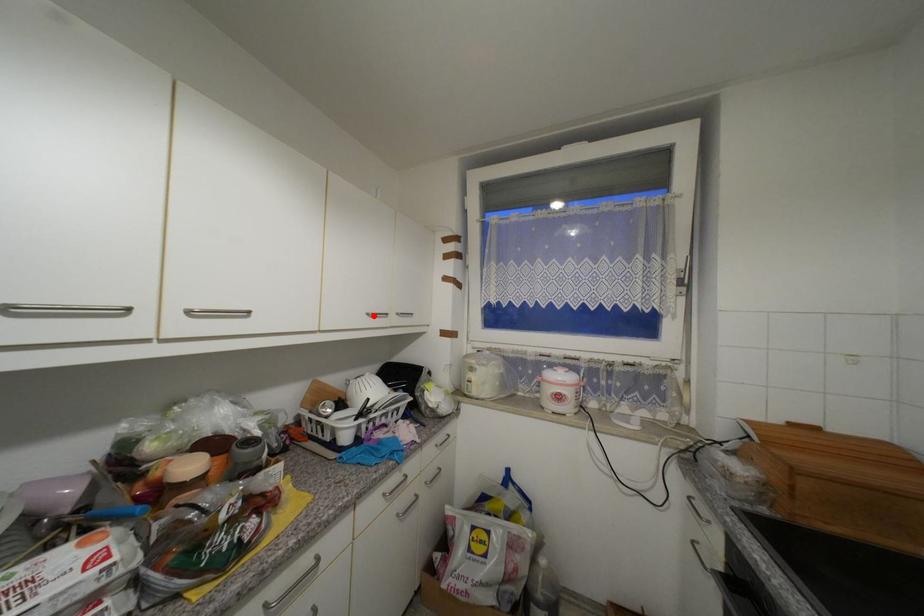
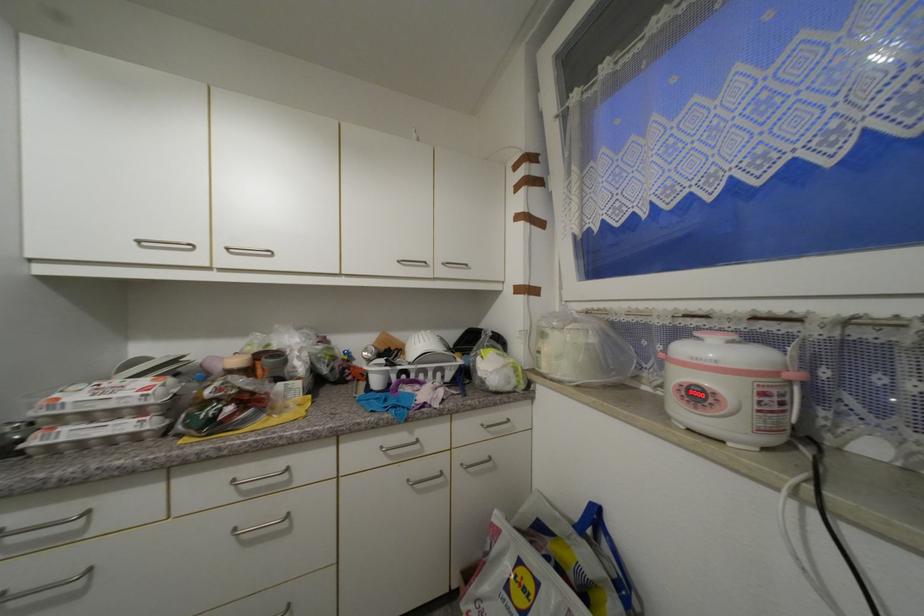
Find the pixel in the second image that matches the highlighted location in the first image.

(405, 262)